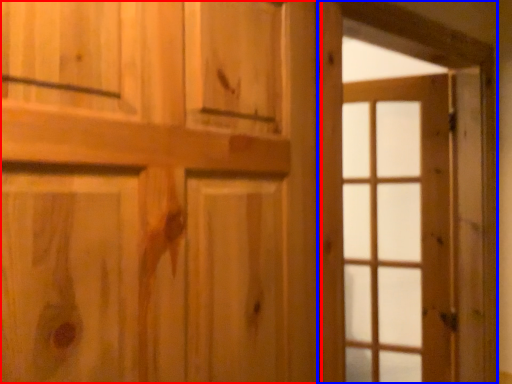
Question: Which point is closer to the camera, door (highlighted by a red box) or barn door (highlighted by a blue box)?

Choices:
 (A) door
 (B) barn door

Answer: (A)